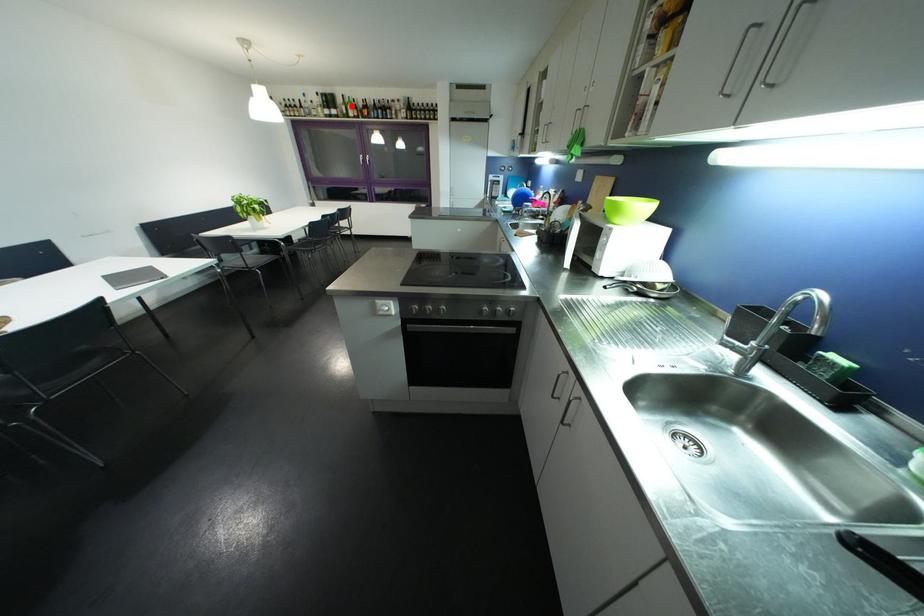
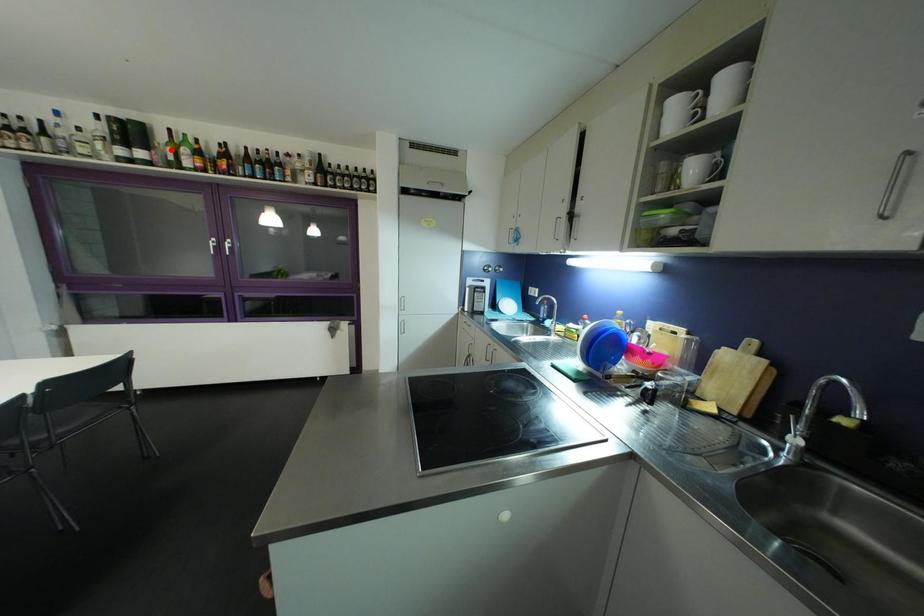
I am providing you with two images of the same scene from different viewpoints. A red point is marked on the first image and another point is marked on the second image. Is the marked point in image1 the same physical position as the marked point in image2?

No